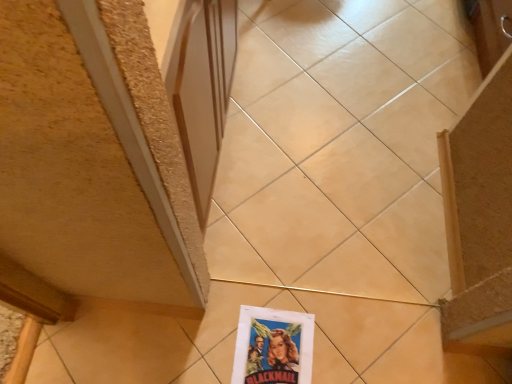
What is the approximate width of beige glossy tile at center?

1.33 meters.

Find the location of `beige glossy tile at center`. beige glossy tile at center is located at coordinates (340, 146).

Describe the element at coordinates (340, 146) in the screenshot. I see `beige glossy tile at center` at that location.

At what (x,y) coordinates should I click in order to perform the action: click on beige glossy tile at center. Please return your answer as a coordinate pair (x, y). This screenshot has width=512, height=384. Looking at the image, I should click on (340, 146).